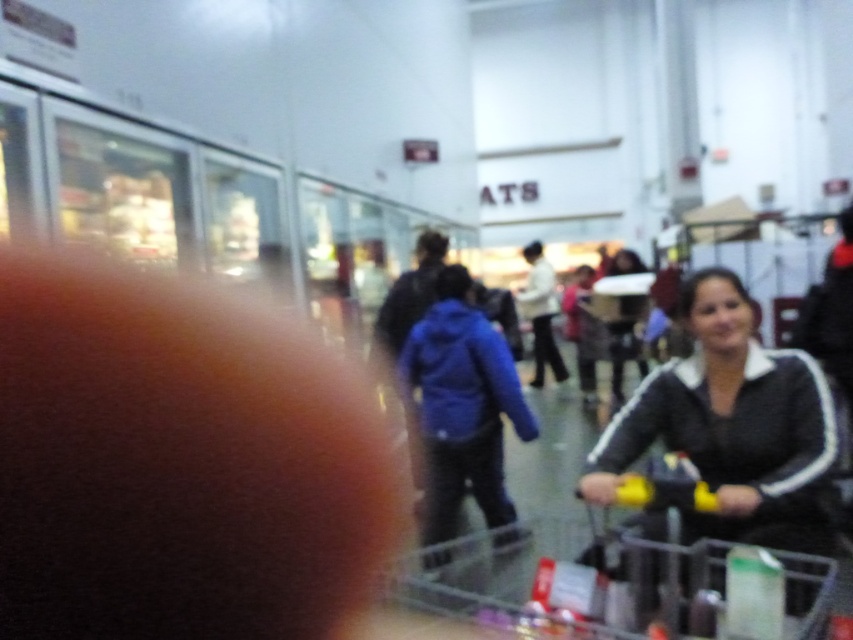
You are a store employee trying to locate a misplaced item. You see the black matte jacket at lower right and the clear plastic shopping cart at lower right. Which object is closer to the camera?

The black matte jacket at lower right is taller than the clear plastic shopping cart at lower right, which suggests it is closer to the camera since objects closer to the viewer appear larger.

You are a delivery person who needs to deliver a package to the customer wearing the black matte jacket at lower right. The delivery robot you are using has a maximum operating range of 2 meters. Can the robot successfully deliver the package to the customer?

The black matte jacket at lower right is 1.88 meters away from the camera, so yes, the delivery robot can successfully deliver the package since the distance is within its 2 meters operating range.

You are a customer in the store and want to reach the clear plastic shopping cart at lower right without stepping on the black matte jacket at lower right. Which direction should you move relative to the shopping cart?

The black matte jacket at lower right is to the right of the clear plastic shopping cart at lower right, so you should move to the left side of the shopping cart to avoid stepping on the jacket.